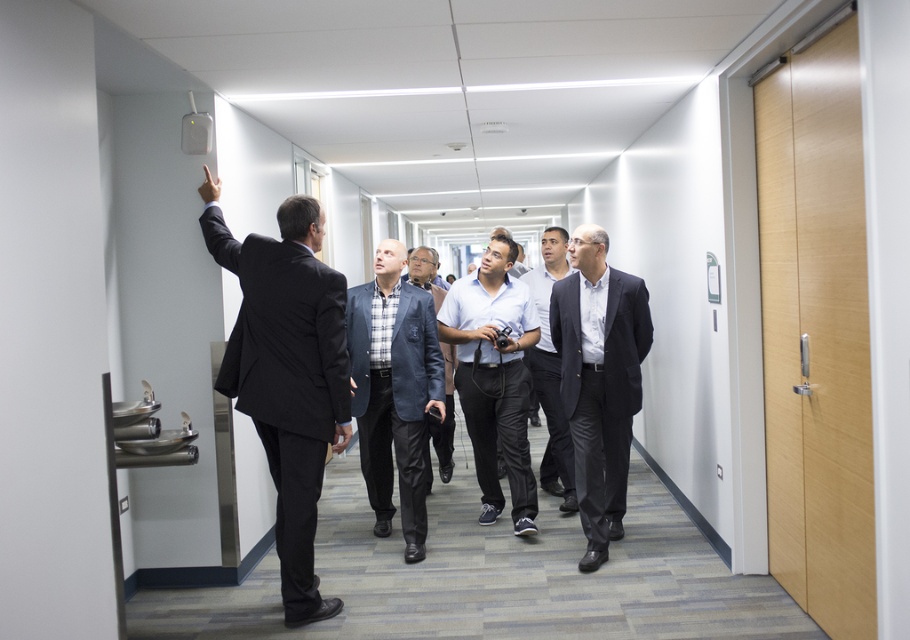
Question: Is white cotton shirt at center smaller than dark blue textured jacket at center?

Choices:
 (A) yes
 (B) no

Answer: (B)

Question: Which of these objects is positioned closest to the white cotton shirt at center?

Choices:
 (A) matte black suit at center
 (B) light brown wood elevator at right
 (C) dark gray wool suit at center

Answer: (A)

Question: Which is nearer to the light brown wood elevator at right?

Choices:
 (A) dark suit at upper left
 (B) dark blue textured jacket at center
 (C) white cotton shirt at center
 (D) matte black suit at center

Answer: (D)

Question: Which object is closer to the camera taking this photo?

Choices:
 (A) blue textured blazer at center
 (B) dark gray wool suit at center
 (C) dark blue textured jacket at center

Answer: (B)

Question: Is light brown wood elevator at right to the right of blue textured blazer at center from the viewer's perspective?

Choices:
 (A) yes
 (B) no

Answer: (A)

Question: Considering the relative positions of white shirt at center and dark blue textured jacket at center in the image provided, where is white shirt at center located with respect to dark blue textured jacket at center?

Choices:
 (A) right
 (B) left

Answer: (A)